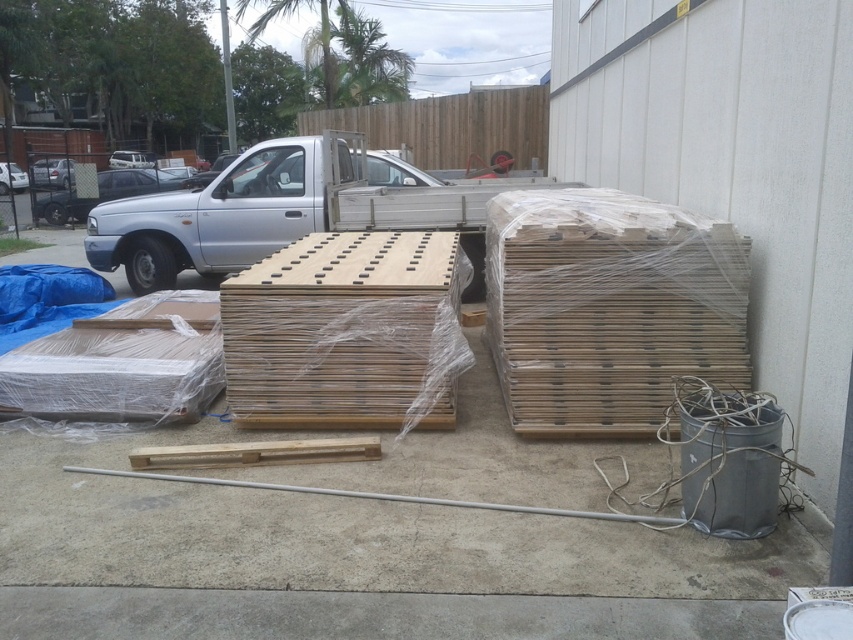
You are standing at the center of the scene. Which direction should you move to reach the wooden crates at right?

The wooden crates at right are located at coordinates approximately 0.481 on the x and 0.714 on the y axis. Since you are at the center, you should move towards the right and slightly forward to reach them.

You are standing at the center of the scene. Which direction should you walk to reach the wooden crates at right marked by point (608, 307)?

The wooden crates at right marked by point (608, 307) are located to the right side of the scene, so you should walk towards the right direction to reach them.

Consider the image. You are a delivery person who needs to place a new wooden crate that is the same size as the wooden crates at right. You have to choose between two available spots in the image. One spot is where the natural wood crate at center is, and the other is an empty space next to the gray bucket. Which spot can fit the new crate without needing to adjust the existing arrangement?

The wooden crates at right is smaller than natural wood crate at center, so the new crate, being the same size as the wooden crates at right, will fit better in the empty space next to the gray bucket without needing to adjust the existing arrangement.